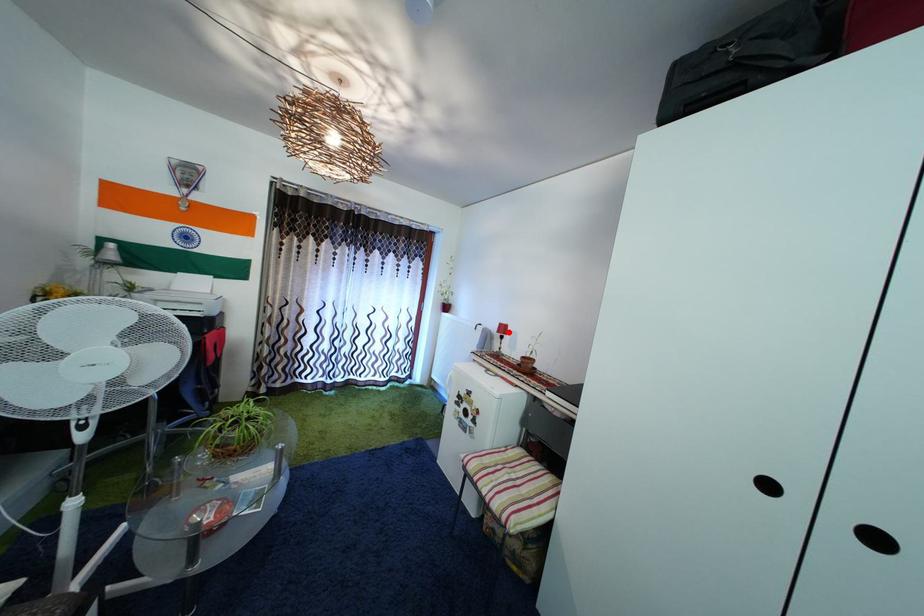
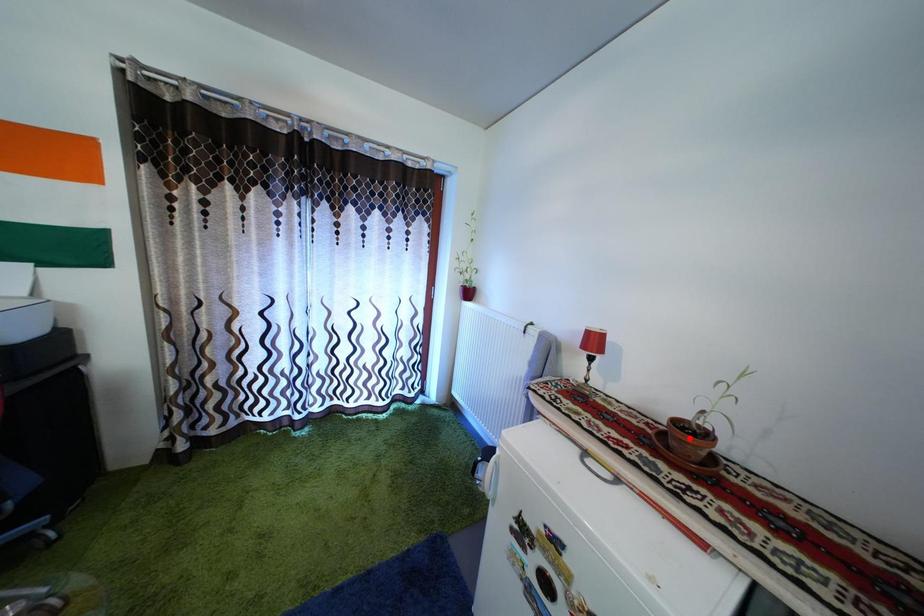
Consider the image. I am providing you with two images of the same scene from different viewpoints. A red point is marked on the first image and another point is marked on the second image. Is the marked point in image1 the same physical position as the marked point in image2?

No